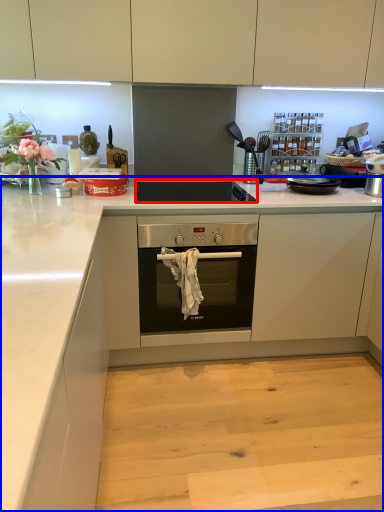
Question: Which of the following is the farthest to the observer, gas stove (highlighted by a red box) or countertop (highlighted by a blue box)?

Choices:
 (A) gas stove
 (B) countertop

Answer: (A)